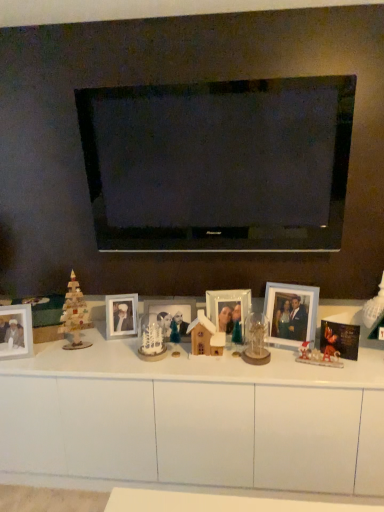
Question: From the image's perspective, would you say matte glass photo frame at center, the 3th picture frame in the left-to-right sequence, is positioned over wooden christmas tree at left?

Choices:
 (A) no
 (B) yes

Answer: (A)

Question: Is matte glass photo frame at center, positioned as the 3th picture frame in right-to-left order, at the right side of wooden christmas tree at left?

Choices:
 (A) no
 (B) yes

Answer: (B)

Question: Is wooden christmas tree at left surrounded by matte glass photo frame at center, positioned as the 3th picture frame in right-to-left order?

Choices:
 (A) yes
 (B) no

Answer: (B)

Question: Is matte glass photo frame at center, positioned as the 3th picture frame in right-to-left order, shorter than wooden christmas tree at left?

Choices:
 (A) no
 (B) yes

Answer: (B)

Question: Is matte glass photo frame at center, positioned as the 3th picture frame in right-to-left order, next to wooden christmas tree at left?

Choices:
 (A) yes
 (B) no

Answer: (B)

Question: Is matte glass photo frame at center, positioned as the 3th picture frame in right-to-left order, thinner than wooden christmas tree at left?

Choices:
 (A) yes
 (B) no

Answer: (A)

Question: Are white frosted glass christmas tree at center, the first toy in the left-to-right sequence, and matte silver picture frame at left, the 5th picture frame in the right-to-left sequence, making contact?

Choices:
 (A) no
 (B) yes

Answer: (A)

Question: Can you confirm if white frosted glass christmas tree at center, which ranks as the 3th toy in right-to-left order, is thinner than matte silver picture frame at left, the 5th picture frame in the right-to-left sequence?

Choices:
 (A) yes
 (B) no

Answer: (B)

Question: From the image's perspective, is white frosted glass christmas tree at center, the first toy in the left-to-right sequence, over matte silver picture frame at left, placed as the first picture frame when sorted from left to right?

Choices:
 (A) no
 (B) yes

Answer: (A)

Question: From a real-world perspective, is white frosted glass christmas tree at center, which ranks as the 3th toy in right-to-left order, positioned over matte silver picture frame at left, the 5th picture frame in the right-to-left sequence, based on gravity?

Choices:
 (A) yes
 (B) no

Answer: (B)

Question: Can you confirm if white frosted glass christmas tree at center, which ranks as the 3th toy in right-to-left order, is bigger than matte silver picture frame at left, placed as the first picture frame when sorted from left to right?

Choices:
 (A) no
 (B) yes

Answer: (A)

Question: Is white frosted glass christmas tree at center, which ranks as the 3th toy in right-to-left order, closer to camera compared to matte silver picture frame at left, placed as the first picture frame when sorted from left to right?

Choices:
 (A) yes
 (B) no

Answer: (A)

Question: From a real-world perspective, is metallic gold ornament at center-right, which is the first toy from right to left, located beneath matte glass photo frame at center, positioned as the 3th picture frame in right-to-left order?

Choices:
 (A) no
 (B) yes

Answer: (B)